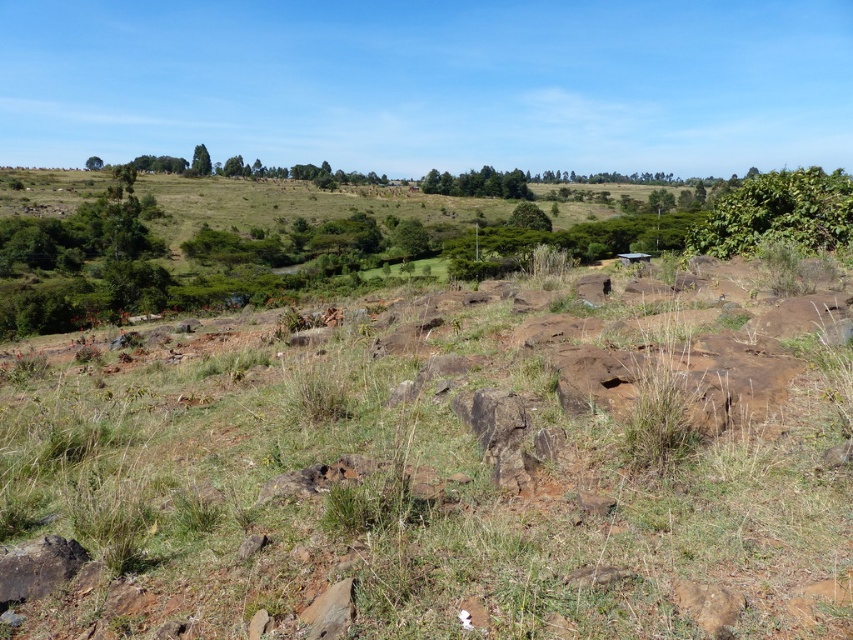
Question: Is green grassy at center above green leafy trees at center?

Choices:
 (A) no
 (B) yes

Answer: (A)

Question: Which point appears closest to the camera in this image?

Choices:
 (A) (776, 182)
 (B) (450, 188)
 (C) (86, 160)

Answer: (A)

Question: Which point is closer to the camera?

Choices:
 (A) (200, 157)
 (B) (824, 177)
 (C) (751, 545)
 (D) (521, 196)

Answer: (C)

Question: Where is green rough bark tree at upper left located in relation to green leafy tree at upper left in the image?

Choices:
 (A) below
 (B) above

Answer: (A)

Question: Which object appears closest to the camera in this image?

Choices:
 (A) green rough bark tree at upper left
 (B) green grassy at center
 (C) green leafy bush at upper right

Answer: (B)

Question: Does green leafy bush at upper right have a larger size compared to green leafy trees at center?

Choices:
 (A) no
 (B) yes

Answer: (A)